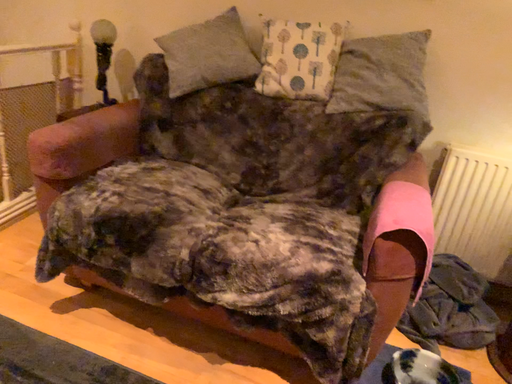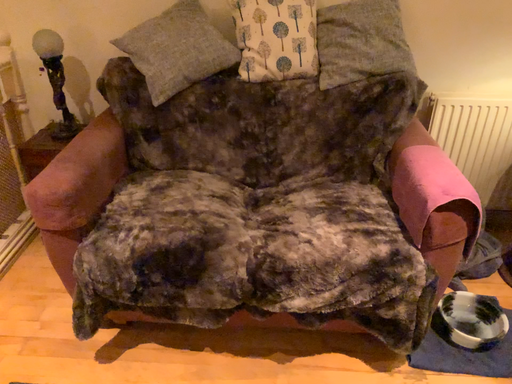
Question: Which way did the camera rotate in the video?

Choices:
 (A) rotated left
 (B) rotated right

Answer: (B)